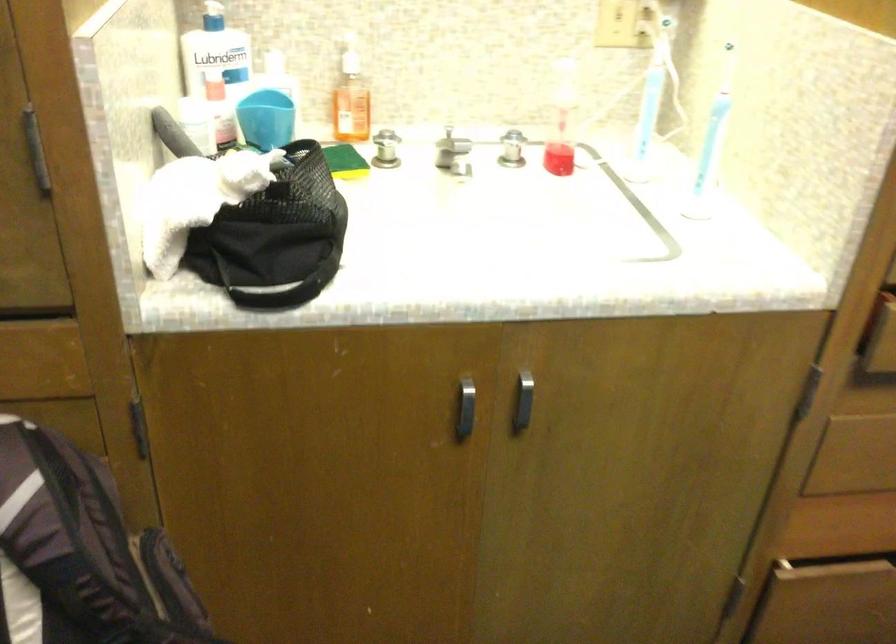
You are a GUI agent. You are given a task and a screenshot of the screen. Output one action in this format:
    pyautogui.click(x=<x>, y=<y>)
    Task: Click on the black bag strap
    The height and width of the screenshot is (644, 896).
    Given the screenshot: What is the action you would take?
    pyautogui.click(x=279, y=286)